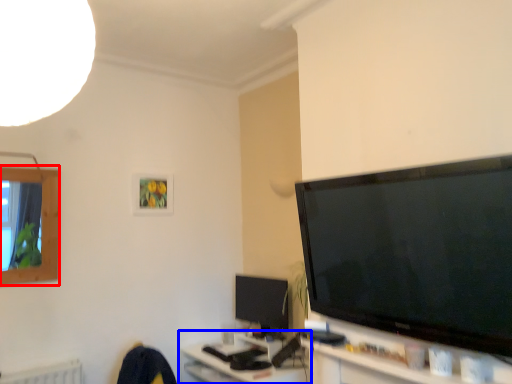
Question: Which of the following is the closest to the observer, window (highlighted by a red box) or computer (highlighted by a blue box)?

Choices:
 (A) window
 (B) computer

Answer: (B)